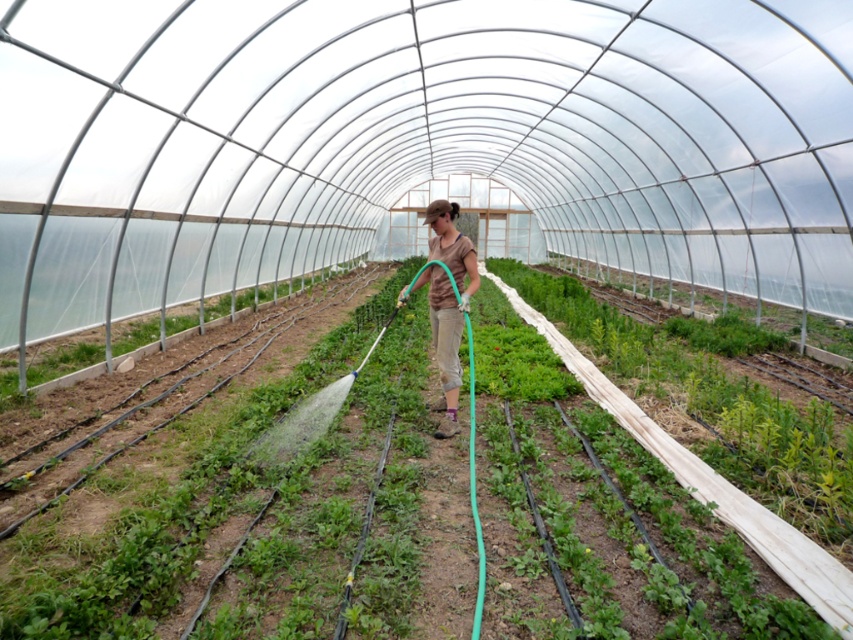
Question: Among these points, which one is farthest from the camera?

Choices:
 (A) (450, 259)
 (B) (76, 356)

Answer: (B)

Question: Is green leafy plant at center closer to camera compared to brown cotton shirt at center?

Choices:
 (A) no
 (B) yes

Answer: (B)

Question: Which object is the farthest from the brown cotton shirt at center?

Choices:
 (A) green leafy plant at center
 (B) green leafy plant at left

Answer: (B)

Question: In this image, where is brown cotton shirt at center located relative to green leafy plant at left?

Choices:
 (A) right
 (B) left

Answer: (A)

Question: From the image, what is the correct spatial relationship of green leafy plant at center in relation to brown cotton shirt at center?

Choices:
 (A) below
 (B) above

Answer: (A)

Question: Among these objects, which one is farthest from the camera?

Choices:
 (A) brown cotton shirt at center
 (B) green leafy plant at left

Answer: (B)